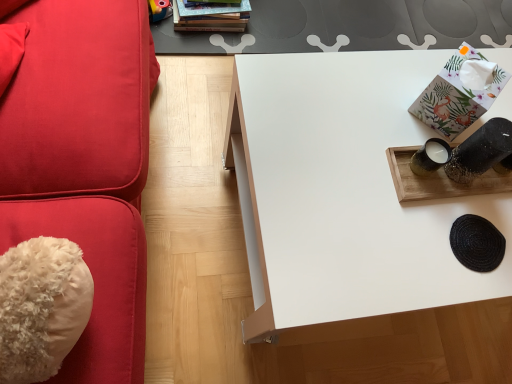
In order to face white matte table at center, should I rotate leftwards or rightwards?

To face it directly, rotate right by 19.695 degrees.

Identify the location of white matte table at center. (343, 192).

Locate an element on the screen. The image size is (512, 384). floral paper tissue at upper right is located at coordinates (459, 93).

What's the angular difference between floral paper tissue at upper right and hardcover books at upper center's facing directions?

45.7 degrees.

From their relative heights in the image, would you say floral paper tissue at upper right is taller or shorter than hardcover books at upper center?

floral paper tissue at upper right is shorter than hardcover books at upper center.

Can you confirm if floral paper tissue at upper right is wider than hardcover books at upper center?

In fact, floral paper tissue at upper right might be narrower than hardcover books at upper center.

Is floral paper tissue at upper right oriented towards hardcover books at upper center?

No, floral paper tissue at upper right is not turned towards hardcover books at upper center.

From the picture: Does hardcover books at upper center appear on the left side of floral paper tissue at upper right?

Correct, you'll find hardcover books at upper center to the left of floral paper tissue at upper right.

From the image's perspective, is hardcover books at upper center under floral paper tissue at upper right?

No, from the image's perspective, hardcover books at upper center is not below floral paper tissue at upper right.

Considering the relative sizes of hardcover books at upper center and floral paper tissue at upper right in the image provided, is hardcover books at upper center smaller than floral paper tissue at upper right?

No, hardcover books at upper center is not smaller than floral paper tissue at upper right.

Looking at this image, considering the sizes of objects hardcover books at upper center and floral paper tissue at upper right in the image provided, who is thinner, hardcover books at upper center or floral paper tissue at upper right?

floral paper tissue at upper right is thinner.

Considering the sizes of objects white matte table at center and hardcover books at upper center in the image provided, who is shorter, white matte table at center or hardcover books at upper center?

hardcover books at upper center.

Based on the photo, from a real-world perspective, is white matte table at center over hardcover books at upper center?

Yes.

Considering the positions of objects white matte table at center and hardcover books at upper center in the image provided, who is behind, white matte table at center or hardcover books at upper center?

hardcover books at upper center is more distant.

Considering the positions of point (312, 292) and point (194, 17), is point (312, 292) closer or farther from the camera than point (194, 17)?

Point (312, 292) is positioned closer to the camera compared to point (194, 17).

Which object is more forward, hardcover books at upper center or white matte table at center?

white matte table at center is in front.

Is hardcover books at upper center thinner than white matte table at center?

Indeed, hardcover books at upper center has a lesser width compared to white matte table at center.

Is hardcover books at upper center oriented away from white matte table at center?

No, white matte table at center is not at the back of hardcover books at upper center.

Image resolution: width=512 pixels, height=384 pixels. In order to click on table in front of the hardcover books at upper center in this screenshot , I will do `click(343, 192)`.

What are the coordinates of `table on the left of floral paper tissue at upper right` in the screenshot? It's located at (343, 192).

From a real-world perspective, is white matte table at center on floral paper tissue at upper right?

No, from a real-world perspective, white matte table at center is not over floral paper tissue at upper right

Is white matte table at center beside floral paper tissue at upper right?

No, white matte table at center is not touching floral paper tissue at upper right.

In the scene shown: Which object is positioned more to the right, white matte table at center or floral paper tissue at upper right?

floral paper tissue at upper right is more to the right.

From the image's perspective, is floral paper tissue at upper right above or below white matte table at center?

floral paper tissue at upper right is above white matte table at center.

Does floral paper tissue at upper right turn towards white matte table at center?

No, floral paper tissue at upper right is not aimed at white matte table at center.

In the image, is floral paper tissue at upper right positioned in front of or behind white matte table at center?

Visually, floral paper tissue at upper right is located behind white matte table at center.

Looking at the image, does floral paper tissue at upper right seem bigger or smaller compared to white matte table at center?

In the image, floral paper tissue at upper right appears to be smaller than white matte table at center.

The width and height of the screenshot is (512, 384). In order to click on package that is above the hardcover books at upper center (from a real-world perspective) in this screenshot , I will do `click(459, 93)`.

Locate an element on the screen. The width and height of the screenshot is (512, 384). package below the hardcover books at upper center (from the image's perspective) is located at coordinates (459, 93).

Based on their spatial positions, is white matte table at center or floral paper tissue at upper right closer to hardcover books at upper center?

white matte table at center is positioned closer to the anchor hardcover books at upper center.

Which object lies further to the anchor point floral paper tissue at upper right, white matte table at center or hardcover books at upper center?

Based on the image, hardcover books at upper center appears to be further to floral paper tissue at upper right.

Which object lies nearer to the anchor point floral paper tissue at upper right, hardcover books at upper center or white matte table at center?

Among the two, white matte table at center is located nearer to floral paper tissue at upper right.

Considering their positions, is floral paper tissue at upper right positioned further to hardcover books at upper center than white matte table at center?

floral paper tissue at upper right.

Based on their spatial positions, is floral paper tissue at upper right or hardcover books at upper center further from white matte table at center?

hardcover books at upper center lies further to white matte table at center than the other object.

When comparing their distances from white matte table at center, does hardcover books at upper center or floral paper tissue at upper right seem further?

The object further to white matte table at center is hardcover books at upper center.

This screenshot has width=512, height=384. Identify the location of package positioned between white matte table at center and hardcover books at upper center from near to far. (459, 93).